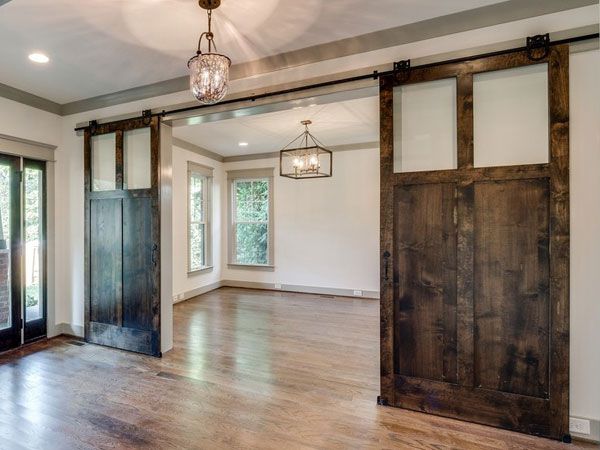
The height and width of the screenshot is (450, 600). What are the coordinates of `electrical outlets` in the screenshot? It's located at click(x=277, y=286), click(x=356, y=292), click(x=181, y=295), click(x=176, y=297), click(x=581, y=427).